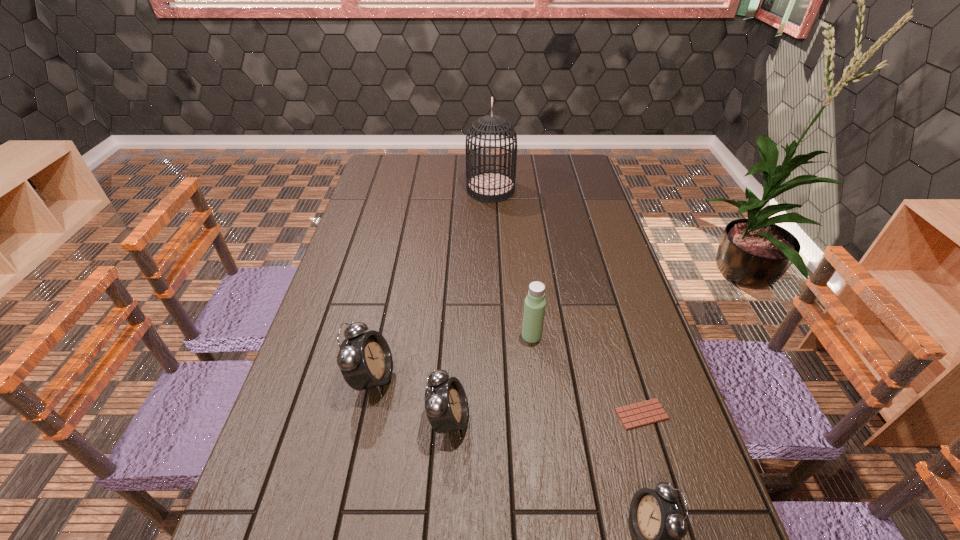
If we want them evenly spaced by inserting an extra alarm_clock among them, please locate a free spot for this new alarm_clock. Please provide its 2D coordinates. Your answer should be formatted as a tuple, i.e. [(x, y)], where the tuple contains the x and y coordinates of a point satisfying the conditions above.

[(540, 469)]